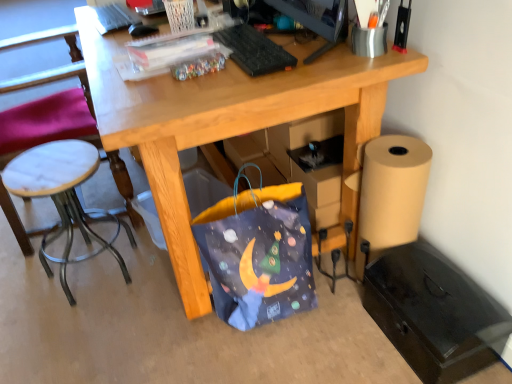
Question: Is black plastic monitor at upper center oriented away from blue fabric bag at lower center?

Choices:
 (A) no
 (B) yes

Answer: (A)

Question: Considering the relative sizes of black plastic monitor at upper center and blue fabric bag at lower center in the image provided, is black plastic monitor at upper center shorter than blue fabric bag at lower center?

Choices:
 (A) yes
 (B) no

Answer: (A)

Question: From the image's perspective, would you say black plastic monitor at upper center is shown under blue fabric bag at lower center?

Choices:
 (A) yes
 (B) no

Answer: (B)

Question: Is black plastic monitor at upper center wider than blue fabric bag at lower center?

Choices:
 (A) no
 (B) yes

Answer: (A)

Question: From the image's perspective, is black plastic monitor at upper center above blue fabric bag at lower center?

Choices:
 (A) no
 (B) yes

Answer: (B)

Question: From a real-world perspective, is black plastic monitor at upper center physically located above or below white marble stool at left?

Choices:
 (A) above
 (B) below

Answer: (A)

Question: Considering the positions of point click(x=322, y=46) and point click(x=0, y=192), is point click(x=322, y=46) closer or farther from the camera than point click(x=0, y=192)?

Choices:
 (A) farther
 (B) closer

Answer: (B)

Question: Is black plastic monitor at upper center spatially inside white marble stool at left, or outside of it?

Choices:
 (A) inside
 (B) outside

Answer: (B)

Question: Considering the positions of black plastic monitor at upper center and white marble stool at left in the image, is black plastic monitor at upper center bigger or smaller than white marble stool at left?

Choices:
 (A) small
 (B) big

Answer: (A)

Question: Is point (59, 231) positioned closer to the camera than point (241, 44)?

Choices:
 (A) farther
 (B) closer

Answer: (A)

Question: Is white marble stool at left bigger or smaller than black plastic keyboard at upper center?

Choices:
 (A) big
 (B) small

Answer: (A)

Question: From the image's perspective, is white marble stool at left positioned above or below black plastic keyboard at upper center?

Choices:
 (A) below
 (B) above

Answer: (A)

Question: Considering the positions of white marble stool at left and black plastic keyboard at upper center in the image, is white marble stool at left taller or shorter than black plastic keyboard at upper center?

Choices:
 (A) tall
 (B) short

Answer: (A)

Question: From their relative heights in the image, would you say black plastic keyboard at upper center is taller or shorter than blue fabric bag at lower center?

Choices:
 (A) tall
 (B) short

Answer: (B)

Question: Considering the positions of point (287, 61) and point (276, 283), is point (287, 61) closer or farther from the camera than point (276, 283)?

Choices:
 (A) closer
 (B) farther

Answer: (A)